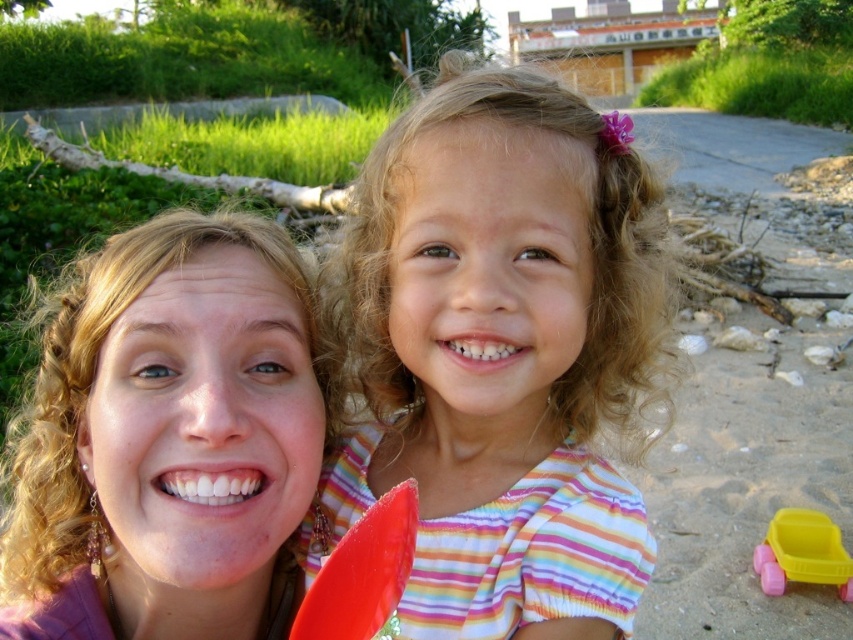
Question: Which point is closer to the camera taking this photo?

Choices:
 (A) (132, 419)
 (B) (781, 532)

Answer: (A)

Question: Which of these objects is positioned farthest from the matte striped shirt at center?

Choices:
 (A) yellow plastic toy car at lower right
 (B) matte purple shirt at center

Answer: (A)

Question: Which point appears closest to the camera in this image?

Choices:
 (A) (461, 228)
 (B) (817, 570)
 (C) (44, 428)

Answer: (A)

Question: In this image, where is matte purple shirt at center located relative to yellow plastic toy car at lower right?

Choices:
 (A) right
 (B) left

Answer: (B)

Question: Does matte purple shirt at center come behind yellow plastic toy car at lower right?

Choices:
 (A) yes
 (B) no

Answer: (B)

Question: Does matte striped shirt at center have a smaller size compared to matte purple shirt at center?

Choices:
 (A) no
 (B) yes

Answer: (A)